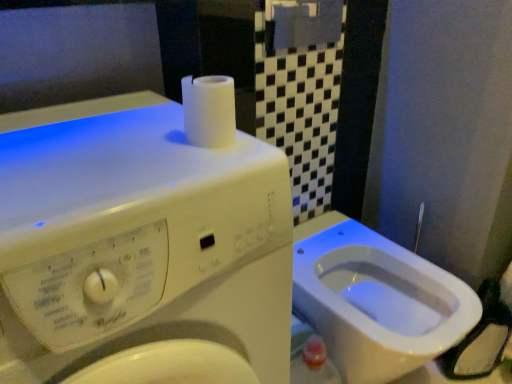
Question: Visually, is white glossy bidet at lower right positioned to the left or to the right of white matte toilet paper at upper center?

Choices:
 (A) left
 (B) right

Answer: (B)

Question: Which is correct: white glossy bidet at lower right is inside white matte toilet paper at upper center, or outside of it?

Choices:
 (A) inside
 (B) outside

Answer: (B)

Question: Estimate the real-world distances between objects in this image. Which object is closer to the white glossy bidet at lower right?

Choices:
 (A) white plastic washing machine at upper left
 (B) white matte toilet paper at upper center

Answer: (A)

Question: Estimate the real-world distances between objects in this image. Which object is closer to the white plastic washing machine at upper left?

Choices:
 (A) white glossy bidet at lower right
 (B) white matte toilet paper at upper center

Answer: (B)